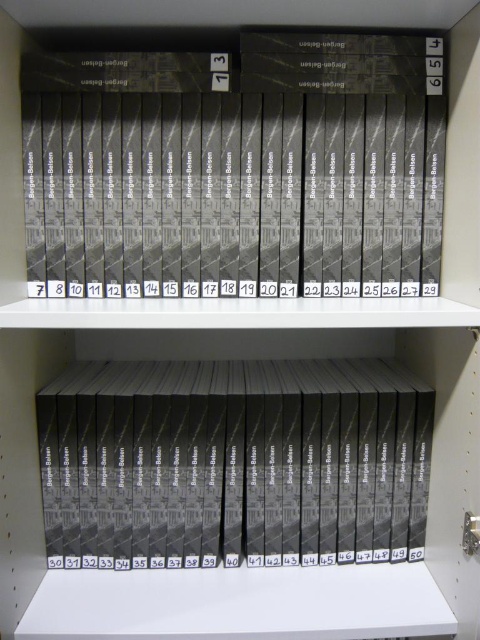
You are standing in front of a bookshelf with two labeled points. The first point is at coordinate (x=187, y=285) and the second is at (x=233, y=476). Which point is closer to you?

Point (x=187, y=285) is closer to the viewer than point (x=233, y=476).

You are organizing a library and need to place two matte black books on a shelf. You have a matte black book at upper center and a matte black book at center. According to their positions, which book should be placed to the left of the other?

The matte black book at upper center should be placed to the left of the matte black book at center because it is positioned on the left side of it.

You are organizing a library and need to place a new book between the matte black book at upper center and the matte black book at center. Since the books are numbered, which one should the new book come after?

The matte black book at upper center is located above the matte black book at center. Since books are typically arranged from top to bottom in numerical order, the new book should come after the matte black book at upper center.